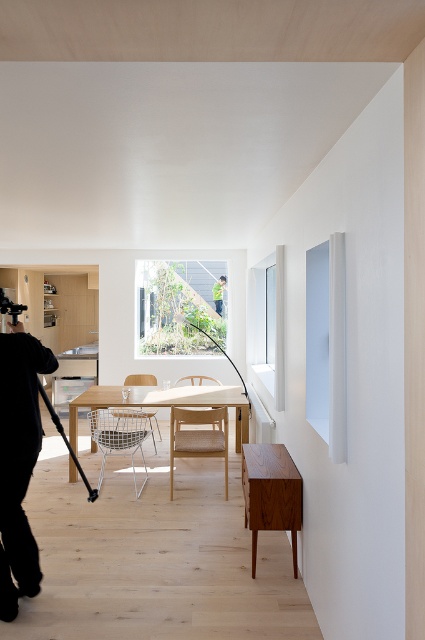
Question: Which point is farther from the camera taking this photo?

Choices:
 (A) (263, 499)
 (B) (70, 452)
 (C) (22, 360)
 (D) (218, 284)

Answer: (D)

Question: Does teak wood sideboard at lower center have a lesser width compared to green fabric shirt at upper center?

Choices:
 (A) yes
 (B) no

Answer: (B)

Question: Among these objects, which one is nearest to the camera?

Choices:
 (A) black fabric camera at left
 (B) green fabric shirt at upper center

Answer: (A)

Question: Among these objects, which one is farthest from the camera?

Choices:
 (A) black fabric camera at left
 (B) green fabric shirt at upper center

Answer: (B)

Question: Is black fabric camera at left positioned at the back of green fabric shirt at upper center?

Choices:
 (A) yes
 (B) no

Answer: (B)

Question: Does teak wood sideboard at lower center have a lesser width compared to green fabric shirt at upper center?

Choices:
 (A) no
 (B) yes

Answer: (A)